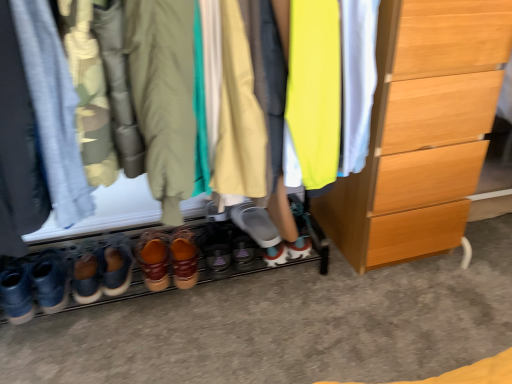
Question: From the image's perspective, is matte gray shoe at center, which is counted as the 1th footwear, starting from the right, positioned above or below leather brown shoes at lower left, the sixth footwear in the right-to-left sequence?

Choices:
 (A) below
 (B) above

Answer: (B)

Question: Does point (261, 233) appear closer or farther from the camera than point (94, 286)?

Choices:
 (A) closer
 (B) farther

Answer: (B)

Question: Which object is the closest to the brown suede shoes at lower center, which ranks as the fifth footwear in right-to-left order?

Choices:
 (A) leather boots at center, which is counted as the fourth footwear, starting from the left
 (B) wooden chest of drawers at right
 (C) denim pants at left, the fourth clothing from the right
 (D) leather brown shoes at center, which is counted as the 3th footwear, starting from the left
 (E) neon yellow fabric at center, which is counted as the 1th clothing, starting from the right

Answer: (D)

Question: Which of these objects is positioned closest to the matte gray shoe at center, which is the 6th footwear in left-to-right order?

Choices:
 (A) khaki cotton jacket at center, which is counted as the 2th clothing, starting from the left
 (B) leather brown shoes at lower left, the 1th footwear viewed from the left
 (C) leather-like brown shoes at center, arranged as the second footwear when viewed from the right
 (D) leather boots at center, which is counted as the fourth footwear, starting from the left
 (E) brown suede shoes at lower center, which ranks as the fifth footwear in right-to-left order

Answer: (C)